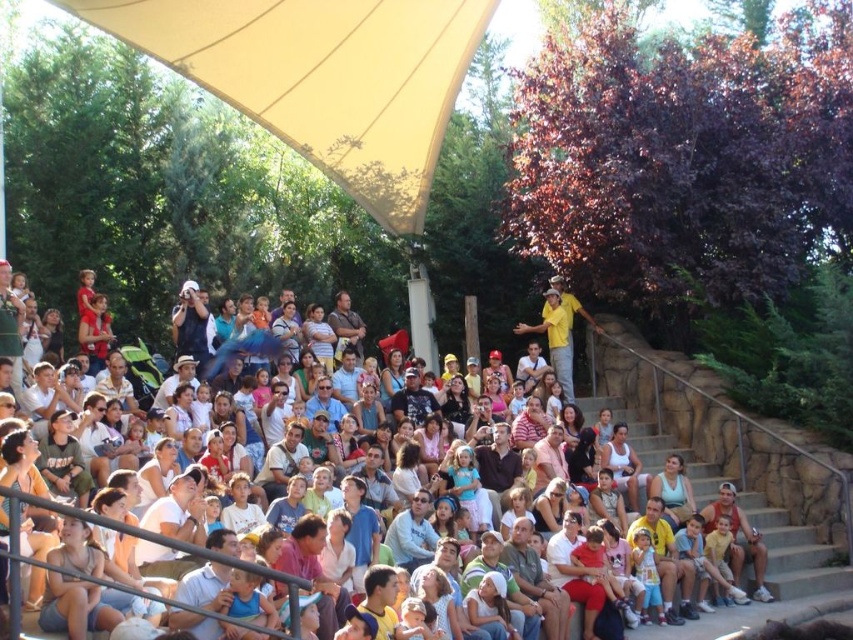
This screenshot has height=640, width=853. I want to click on matte black shirt at center, so click(412, 400).

Which of these two, matte black shirt at center or light blue shirt at center, stands shorter?

Standing shorter between the two is matte black shirt at center.

The height and width of the screenshot is (640, 853). I want to click on matte black shirt at center, so click(x=412, y=400).

Consider the image. Can you confirm if white cotton tank top at center is wider than matte black shirt at center?

No, white cotton tank top at center is not wider than matte black shirt at center.

Measure the distance between white cotton tank top at center and matte black shirt at center.

The distance of white cotton tank top at center from matte black shirt at center is 56.17 feet.

Does point (616, 452) come closer to viewer compared to point (393, 406)?

That is True.

Identify the location of white cotton tank top at center. (624, 467).

Can you confirm if matte white crowd at center is smaller than matte black shirt at center?

Incorrect, matte white crowd at center is not smaller in size than matte black shirt at center.

Which is behind, point (38, 563) or point (407, 417)?

The point (407, 417) is more distant.

The width and height of the screenshot is (853, 640). Identify the location of matte white crowd at center. (154, 536).